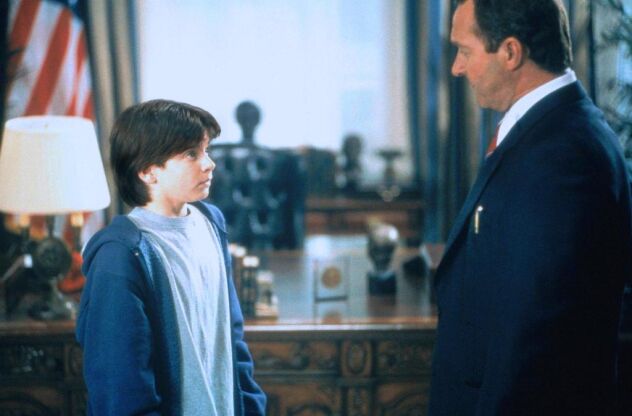
Where is `coat`? Image resolution: width=632 pixels, height=416 pixels. coat is located at coordinates (540, 151).